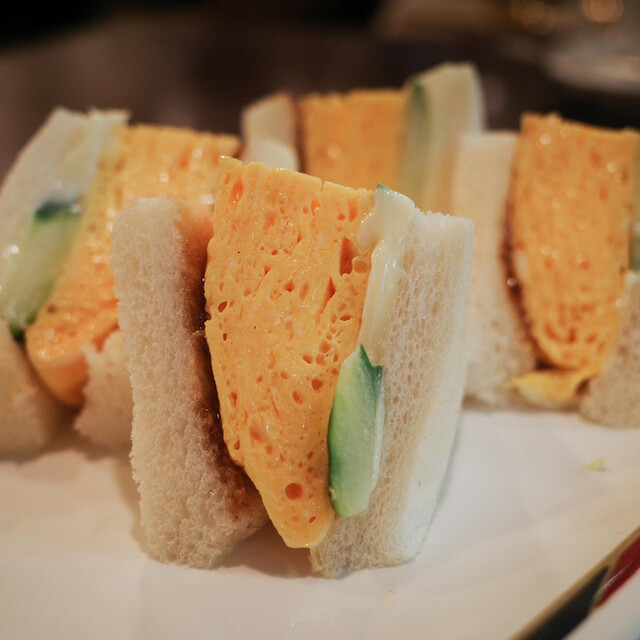
At what (x,y) coordinates should I click in order to perform the action: click on plate. Please return your answer as a coordinate pair (x, y). Looking at the image, I should click on (524, 525).